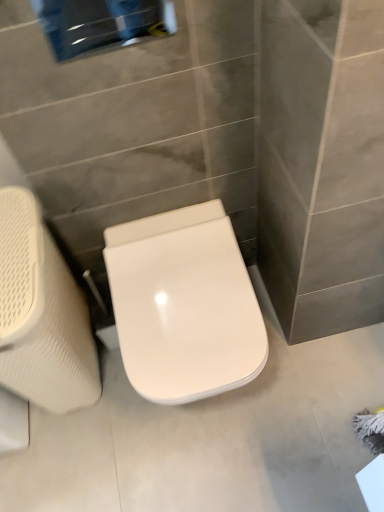
Question: Is white textured swivel chair at left to the left of white glossy toilet seat at center from the viewer's perspective?

Choices:
 (A) no
 (B) yes

Answer: (B)

Question: From a real-world perspective, is white textured swivel chair at left positioned over white glossy toilet seat at center based on gravity?

Choices:
 (A) yes
 (B) no

Answer: (A)

Question: From the image's perspective, is white textured swivel chair at left below white glossy toilet seat at center?

Choices:
 (A) no
 (B) yes

Answer: (B)

Question: Can we say white textured swivel chair at left lies outside white glossy toilet seat at center?

Choices:
 (A) yes
 (B) no

Answer: (A)

Question: Does white textured swivel chair at left come in front of white glossy toilet seat at center?

Choices:
 (A) yes
 (B) no

Answer: (A)

Question: Is white textured swivel chair at left touching white glossy toilet seat at center?

Choices:
 (A) no
 (B) yes

Answer: (A)

Question: Does white glossy toilet seat at center have a lesser width compared to white textured swivel chair at left?

Choices:
 (A) yes
 (B) no

Answer: (B)

Question: From the image's perspective, would you say white glossy toilet seat at center is shown under white textured swivel chair at left?

Choices:
 (A) no
 (B) yes

Answer: (A)

Question: Does white glossy toilet seat at center have a smaller size compared to white textured swivel chair at left?

Choices:
 (A) no
 (B) yes

Answer: (B)

Question: Is white glossy toilet seat at center shorter than white textured swivel chair at left?

Choices:
 (A) yes
 (B) no

Answer: (A)

Question: Is white glossy toilet seat at center positioned far away from white textured swivel chair at left?

Choices:
 (A) yes
 (B) no

Answer: (B)

Question: Does white glossy toilet seat at center appear on the left side of white textured swivel chair at left?

Choices:
 (A) yes
 (B) no

Answer: (B)

Question: Is point 82,301 closer or farther from the camera than point 205,373?

Choices:
 (A) farther
 (B) closer

Answer: (A)